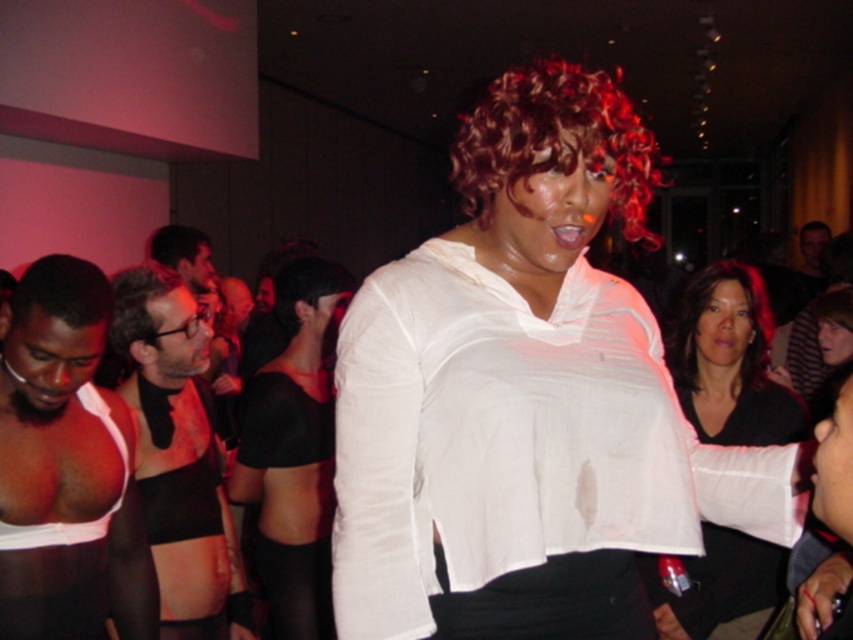
You are standing in the dimly lit room and want to approach the white sheer blouse at center to hand over a gift. Considering the distance, can you reach it without moving closer?

The white sheer blouse at center is 1.10 meters away from viewer, so you can reach it without moving closer if your arm length is at least 1.10 meters. However, typical human arm length is shorter, so you might need to move closer to ensure you can reach.

You are a photographer at the event and want to ensure both the white sheer blouse at center and the curly brown wig at center are fully visible in your photo. Given their sizes, which one might require you to adjust your camera angle to capture its full height?

The curly brown wig at center is taller than the white sheer blouse at center, so you might need to adjust your camera angle to capture its full height.

You are a photographer at the event and want to capture a clear photo of the white sheer blouse at center without the matte black arm at center blocking it. Based on the scene description, can you adjust your position to achieve this?

Yes, since the white sheer blouse at center is in front of the matte black arm at center, you can move your camera angle slightly to focus on the white sheer blouse at center while avoiding the matte black arm at center in the foreground.